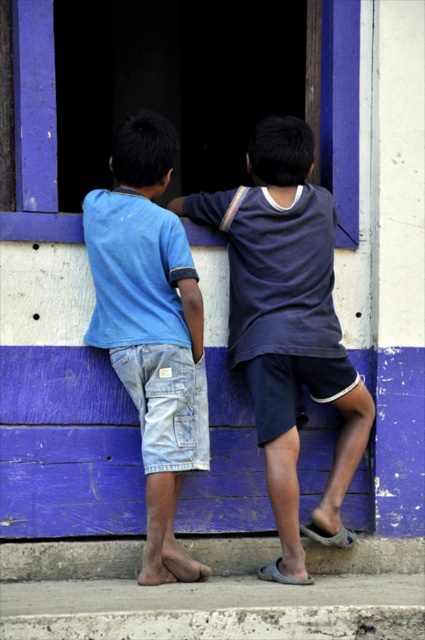
You are a tailor who needs to create a new design for the dark blue cotton shirt at center. You want to ensure that the shirt will not be wider than the blue wooden window at upper center when viewed from the front. Based on the scene, what adjustment should you make to the shirt design?

The dark blue cotton shirt at center is currently wider than the blue wooden window at upper center. To make it narrower, the tailor should reduce the shirt design to ensure it is not wider than the blue wooden window at upper center.

You are standing in front of the wall with two boys leaning against it. There is a point marked at coordinates (150,326). What object is located at that point?

The point at coordinates (150,326) is occupied by light blue denim shorts at center.